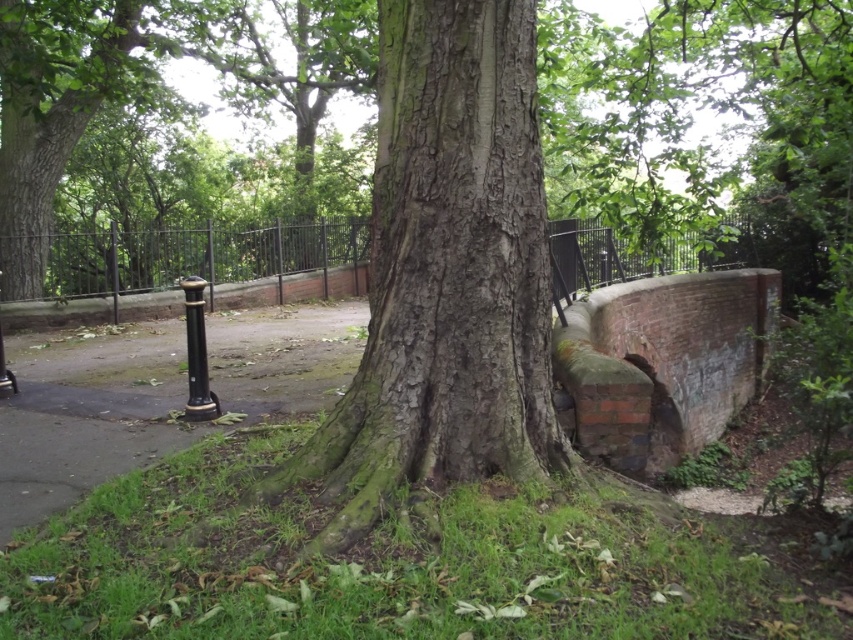
Describe the element at coordinates (199, 257) in the screenshot. I see `black metal fence at center` at that location.

Between black metal fence at center and black polished metal bollard at center-left, which one has less height?

black polished metal bollard at center-left

This screenshot has width=853, height=640. Describe the element at coordinates (199, 257) in the screenshot. I see `black metal fence at center` at that location.

The image size is (853, 640). What are the coordinates of `black metal fence at center` in the screenshot? It's located at (199, 257).

Who is positioned more to the right, smooth bark tree trunk at center or black polished metal bollard at center-left?

Positioned to the right is smooth bark tree trunk at center.

Is the position of smooth bark tree trunk at center less distant than that of black polished metal bollard at center-left?

Yes, it is.

Who is more forward, (427, 93) or (184, 292)?

Point (427, 93) is more forward.

Locate an element on the screen. This screenshot has width=853, height=640. smooth bark tree trunk at center is located at coordinates (445, 273).

Can you confirm if smooth bark tree trunk at center is positioned to the right of black metal fence at center?

In fact, smooth bark tree trunk at center is to the left of black metal fence at center.

Who is higher up, smooth bark tree trunk at center or black metal fence at center?

black metal fence at center is higher up.

Measure the distance between point (386, 445) and camera.

A distance of 2.46 meters exists between point (386, 445) and camera.

This screenshot has height=640, width=853. Identify the location of smooth bark tree trunk at center. pos(445,273).